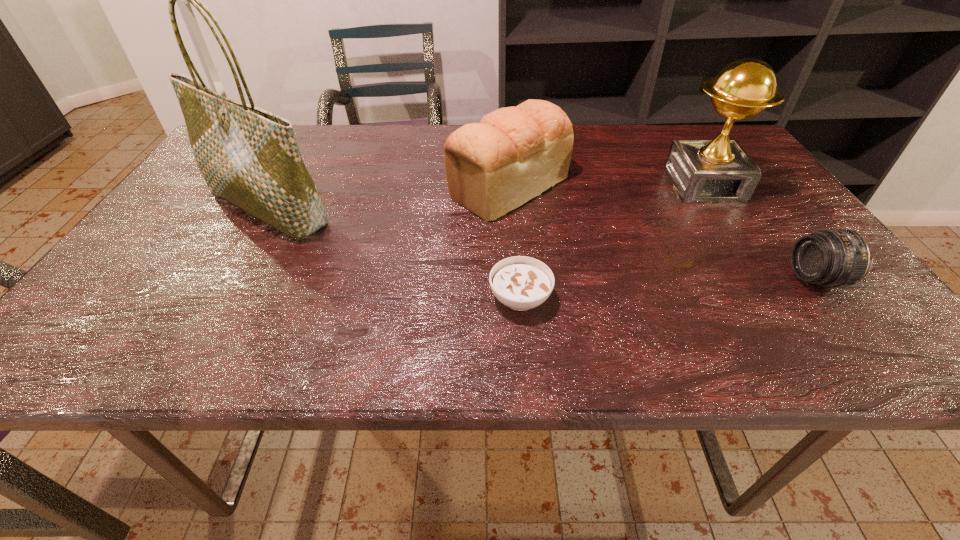
Select which object appears as the closest to the shortest object. Please provide its 2D coordinates. Your answer should be formatted as a tuple, i.e. [(x, y)], where the tuple contains the x and y coordinates of a point satisfying the conditions above.

[(513, 154)]

Identify which object is located as the third nearest to the second tallest object. Please provide its 2D coordinates. Your answer should be formatted as a tuple, i.e. [(x, y)], where the tuple contains the x and y coordinates of a point satisfying the conditions above.

[(521, 283)]